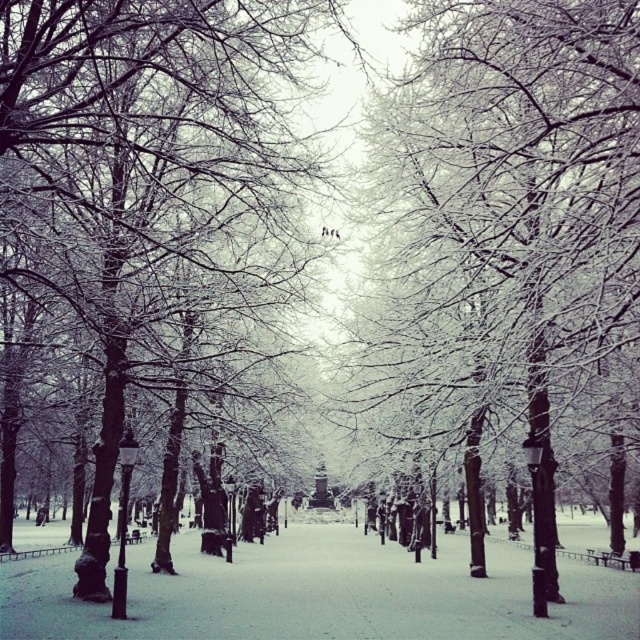
You are a photographer wanting to capture the contrast between the two white frosty trees in the winter scene. Which of the two objects, the white frosty branches at center or the white frosty tree at center, would appear more slender in your photo?

The white frosty branches at center would appear more slender in the photo because it is thinner than the white frosty tree at center.

You are standing in the winter park scene and want to walk from the point at coordinates point (513, 316) to the point at coordinates point (282, 58). Which direction should you move to get closer to your destination?

To move from point (513, 316) to point (282, 58), you should move towards the left and downward since point (282, 58) is located to the left and lower than point (513, 316).

You are standing on the snowy pathway and see the white frosty branches at center and the white frosty tree at center. Which one is closer to you?

The white frosty branches at center are closer to you than the white frosty tree at center because they are positioned further to the viewer in the image.